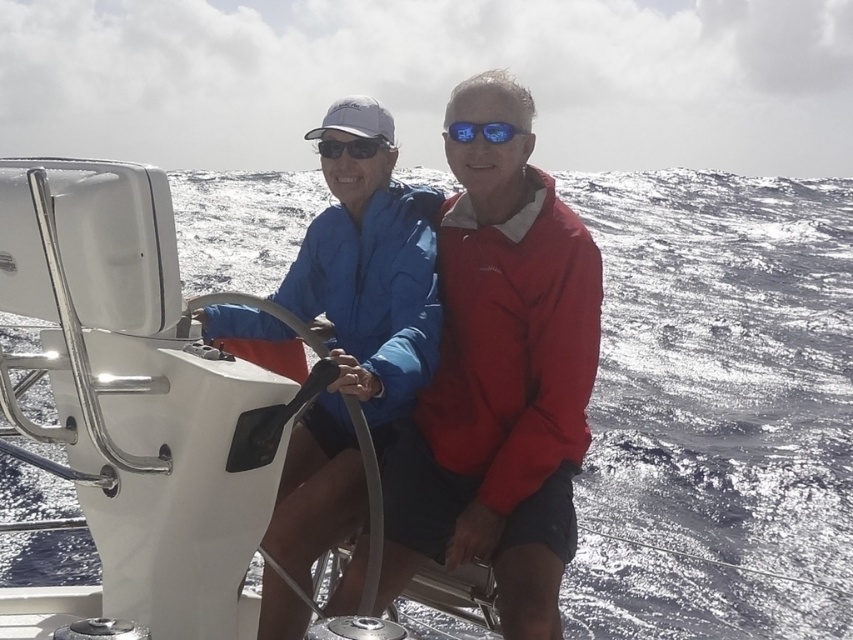
Question: Among these points, which one is farthest from the camera?

Choices:
 (A) (392, 147)
 (B) (451, 416)

Answer: (A)

Question: From the image, what is the correct spatial relationship of blue fabric jacket at center in relation to matte black sunglasses at center?

Choices:
 (A) right
 (B) left

Answer: (A)

Question: Which is nearer to the blue fabric jacket at center?

Choices:
 (A) matte black sunglasses at center
 (B) glistening water at steering wheel left

Answer: (A)

Question: Estimate the real-world distances between objects in this image. Which object is farther from the blue fabric jacket at center?

Choices:
 (A) blue reflective lenses at center
 (B) matte black sunglasses at center

Answer: (B)

Question: Is blue reflective lenses at center bigger than matte black sunglasses at center?

Choices:
 (A) no
 (B) yes

Answer: (A)

Question: Does blue reflective lenses at center appear under matte black sunglasses at center?

Choices:
 (A) no
 (B) yes

Answer: (A)